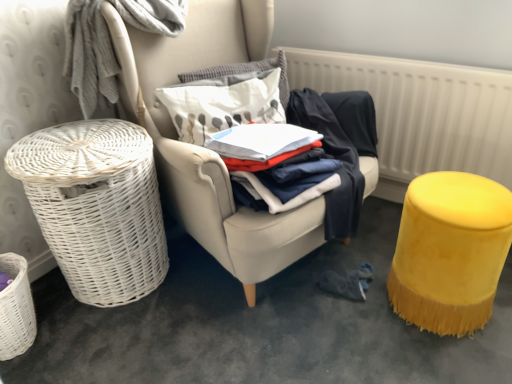
Locate an element on the screen. free space that is in between white wicker basket at left and white wicker basket at left is located at coordinates (170, 320).